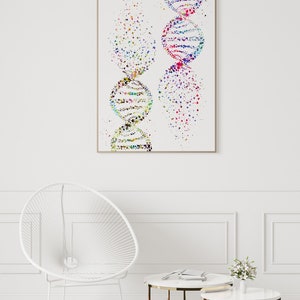
Find the location of a particular element. The height and width of the screenshot is (300, 300). vase is located at coordinates (243, 285).